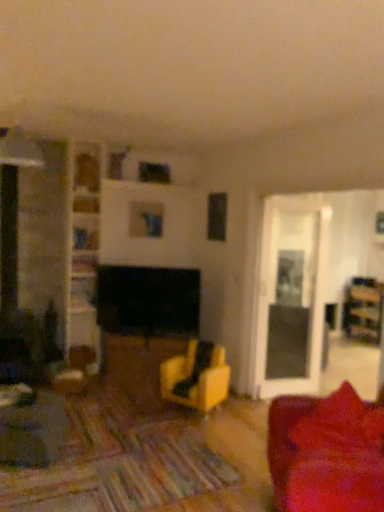
Question: Is wooden bookshelf at center, the 3th shelf when ordered from top to bottom, not near wooden shelf at upper center, which is the 1th shelf from top to bottom?

Choices:
 (A) yes
 (B) no

Answer: (B)

Question: Considering the relative sizes of wooden bookshelf at center, the 3th shelf when ordered from top to bottom, and wooden shelf at upper center, which ranks as the fourth shelf in bottom-to-top order, in the image provided, is wooden bookshelf at center, the 3th shelf when ordered from top to bottom, taller than wooden shelf at upper center, which ranks as the fourth shelf in bottom-to-top order,?

Choices:
 (A) no
 (B) yes

Answer: (B)

Question: Considering the relative sizes of wooden bookshelf at center, the 3th shelf when ordered from top to bottom, and wooden shelf at upper center, which ranks as the fourth shelf in bottom-to-top order, in the image provided, is wooden bookshelf at center, the 3th shelf when ordered from top to bottom, smaller than wooden shelf at upper center, which ranks as the fourth shelf in bottom-to-top order,?

Choices:
 (A) no
 (B) yes

Answer: (A)

Question: Is wooden bookshelf at center, the 3th shelf when ordered from top to bottom, closer to camera compared to wooden shelf at upper center, which ranks as the fourth shelf in bottom-to-top order?

Choices:
 (A) no
 (B) yes

Answer: (B)

Question: Can you confirm if wooden bookshelf at center, the 3th shelf when ordered from top to bottom, is wider than wooden shelf at upper center, which is the 1th shelf from top to bottom?

Choices:
 (A) no
 (B) yes

Answer: (B)

Question: Is point (87, 227) positioned closer to the camera than point (306, 458)?

Choices:
 (A) farther
 (B) closer

Answer: (A)

Question: From a real-world perspective, relative to velvet red couch at lower right, is wooden bookshelf at upper left, the second shelf from the top, vertically above or below?

Choices:
 (A) above
 (B) below

Answer: (A)

Question: Is wooden bookshelf at upper left, the second shelf from the top, taller or shorter than velvet red couch at lower right?

Choices:
 (A) short
 (B) tall

Answer: (A)

Question: In the image, is wooden bookshelf at upper left, which is counted as the third shelf, starting from the bottom, on the left side or the right side of velvet red couch at lower right?

Choices:
 (A) left
 (B) right

Answer: (A)

Question: From the image's perspective, relative to wooden bookshelf at upper left, which is counted as the third shelf, starting from the bottom, is wooden bookshelf at left, the fourth shelf when ordered from top to bottom, above or below?

Choices:
 (A) below
 (B) above

Answer: (A)

Question: Based on their positions, is wooden bookshelf at left, which is the first shelf from bottom to top, located to the left or right of wooden bookshelf at upper left, which is counted as the third shelf, starting from the bottom?

Choices:
 (A) right
 (B) left

Answer: (B)

Question: From their relative heights in the image, would you say wooden bookshelf at left, the fourth shelf when ordered from top to bottom, is taller or shorter than wooden bookshelf at upper left, the second shelf from the top?

Choices:
 (A) tall
 (B) short

Answer: (A)

Question: Looking at their shapes, would you say wooden bookshelf at left, which is the first shelf from bottom to top, is wider or thinner than wooden bookshelf at upper left, the second shelf from the top?

Choices:
 (A) thin
 (B) wide

Answer: (A)

Question: From a real-world perspective, relative to wooden bookshelf at upper left, which is counted as the third shelf, starting from the bottom, is velvet red couch at lower right vertically above or below?

Choices:
 (A) below
 (B) above

Answer: (A)

Question: Is velvet red couch at lower right inside the boundaries of wooden bookshelf at upper left, the second shelf from the top, or outside?

Choices:
 (A) outside
 (B) inside

Answer: (A)